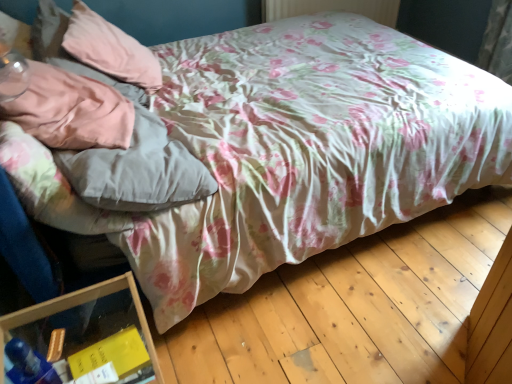
Question: Would you say satin pink pillow at upper left, which is the second pillow in back-to-front order, is part of pink fabric pillow at upper left, marked as the second pillow in a front-to-back arrangement,'s contents?

Choices:
 (A) no
 (B) yes

Answer: (A)

Question: Is pink fabric pillow at upper left, marked as the second pillow in a front-to-back arrangement, far from satin pink pillow at upper left, which is the second pillow in back-to-front order?

Choices:
 (A) yes
 (B) no

Answer: (B)

Question: Is pink fabric pillow at upper left, the 1th pillow from the back, behind satin pink pillow at upper left, which is the second pillow in back-to-front order?

Choices:
 (A) no
 (B) yes

Answer: (B)

Question: Considering the relative sizes of pink fabric pillow at upper left, the 1th pillow from the back, and satin pink pillow at upper left, which is the first pillow from front to back, in the image provided, is pink fabric pillow at upper left, the 1th pillow from the back, wider than satin pink pillow at upper left, which is the first pillow from front to back,?

Choices:
 (A) no
 (B) yes

Answer: (B)

Question: Is the position of pink fabric pillow at upper left, the 1th pillow from the back, less distant than that of satin pink pillow at upper left, which is the first pillow from front to back?

Choices:
 (A) yes
 (B) no

Answer: (B)

Question: Does pink fabric pillow at upper left, marked as the second pillow in a front-to-back arrangement, appear on the right side of satin pink pillow at upper left, which is the first pillow from front to back?

Choices:
 (A) no
 (B) yes

Answer: (A)

Question: Is transparent plastic container at lower left positioned with its back to pink fabric pillow at upper left, marked as the second pillow in a front-to-back arrangement?

Choices:
 (A) yes
 (B) no

Answer: (B)

Question: Is transparent plastic container at lower left taller than pink fabric pillow at upper left, marked as the second pillow in a front-to-back arrangement?

Choices:
 (A) no
 (B) yes

Answer: (B)

Question: Does transparent plastic container at lower left have a lesser width compared to pink fabric pillow at upper left, the 1th pillow from the back?

Choices:
 (A) no
 (B) yes

Answer: (B)

Question: Considering the relative sizes of transparent plastic container at lower left and pink fabric pillow at upper left, the 1th pillow from the back, in the image provided, is transparent plastic container at lower left wider than pink fabric pillow at upper left, the 1th pillow from the back,?

Choices:
 (A) no
 (B) yes

Answer: (A)

Question: From a real-world perspective, is transparent plastic container at lower left physically below pink fabric pillow at upper left, the 1th pillow from the back?

Choices:
 (A) no
 (B) yes

Answer: (B)

Question: Is transparent plastic container at lower left next to pink fabric pillow at upper left, marked as the second pillow in a front-to-back arrangement, and touching it?

Choices:
 (A) yes
 (B) no

Answer: (B)

Question: Could you tell me if pink fabric pillow at upper left, marked as the second pillow in a front-to-back arrangement, is turned towards transparent plastic container at lower left?

Choices:
 (A) no
 (B) yes

Answer: (A)